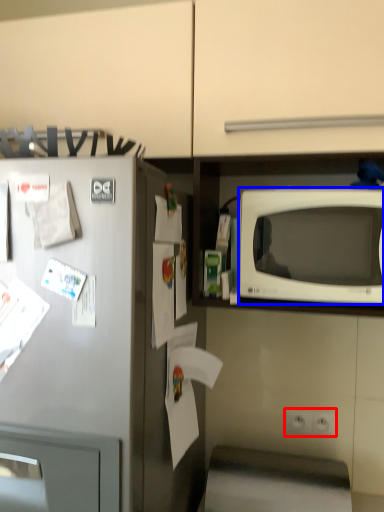
Question: Which object is closer to the camera taking this photo, electric outlet (highlighted by a red box) or microwave oven (highlighted by a blue box)?

Choices:
 (A) electric outlet
 (B) microwave oven

Answer: (B)